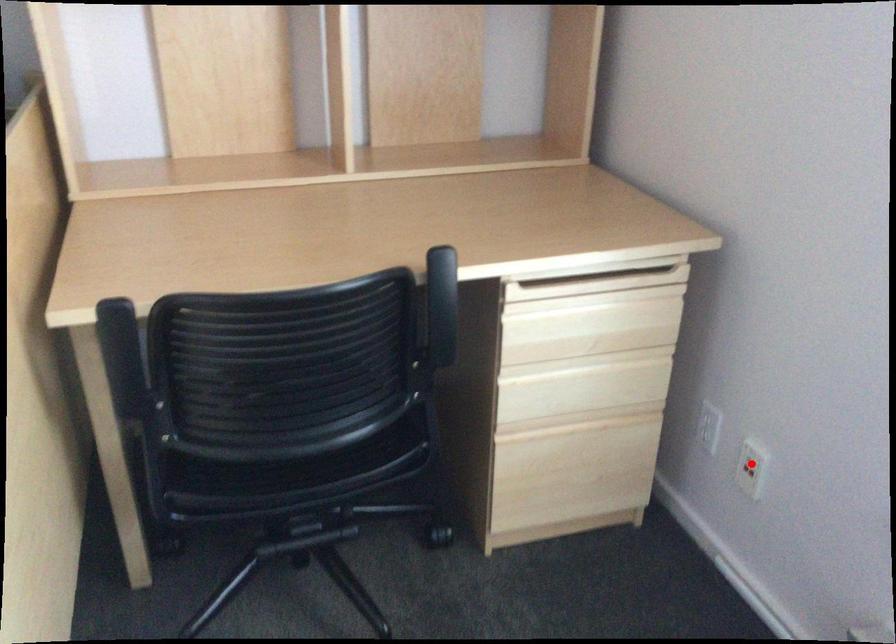
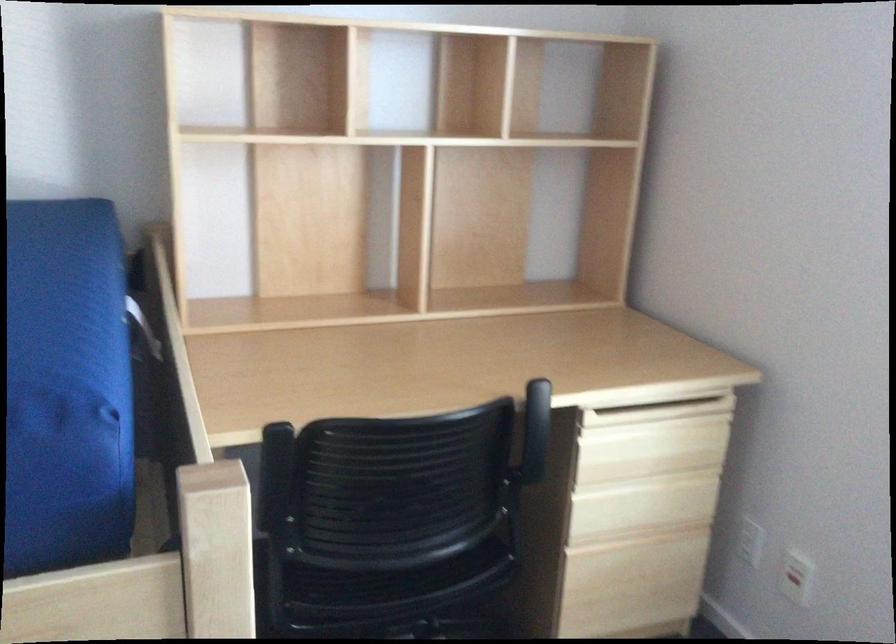
Question: A red point is marked in image1. In image2, is the corresponding 3D point closer to the camera or farther? Reply with the corresponding letter.

Choices:
 (A) The corresponding 3D point is closer.
 (B) The corresponding 3D point is farther.

Answer: (B)